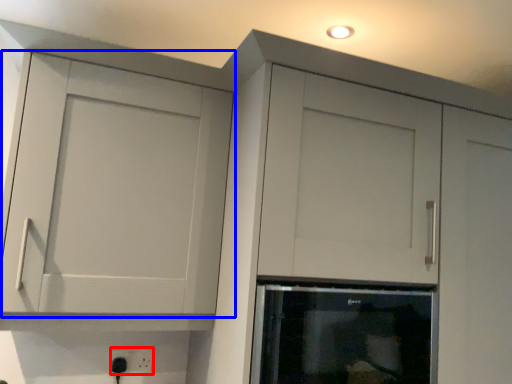
Question: Which object appears farthest to the camera in this image, electric outlet (highlighted by a red box) or cupboard (highlighted by a blue box)?

Choices:
 (A) electric outlet
 (B) cupboard

Answer: (A)